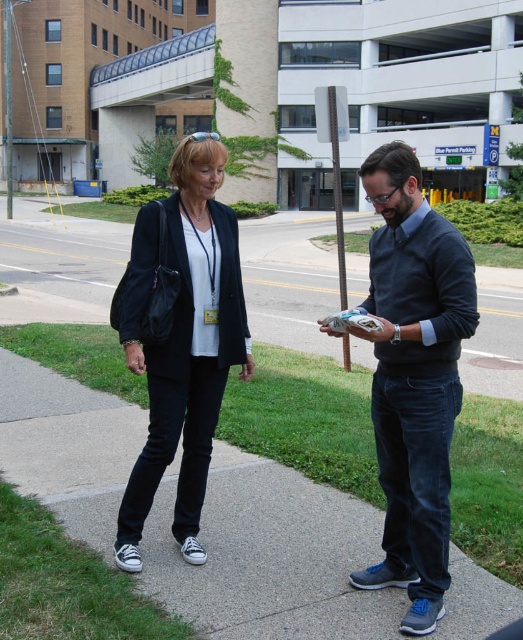
You are a fashion designer analyzing the urban scene. You need to determine which item is taller between the dark blue jeans at center and the black canvas sneakers at lower left. Which one is taller?

The dark blue jeans at center is taller than the black canvas sneakers at lower left according to the description.

You are a photographer aiming to capture a candid shot of the two people on the sidewalk. You notice two points of interest marked at coordinates point (431,547) and point (408,532). Which point should you focus on to ensure it appears larger in your photo?

Point (431,547) should be focused on because it is closer to the viewer, making it appear larger in the photo compared to point (408,532) which is farther away.